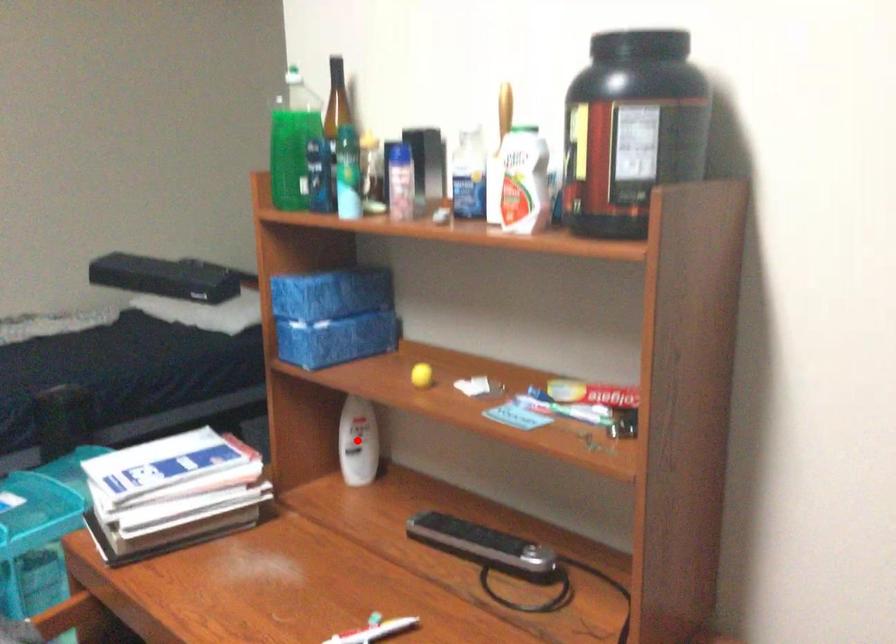
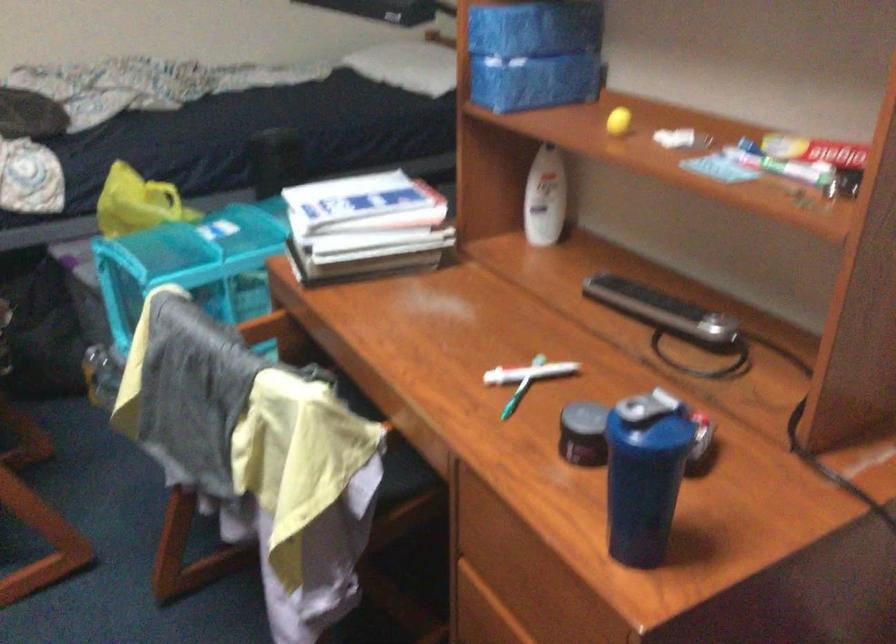
Find the pixel in the second image that matches the highlighted location in the first image.

(545, 198)